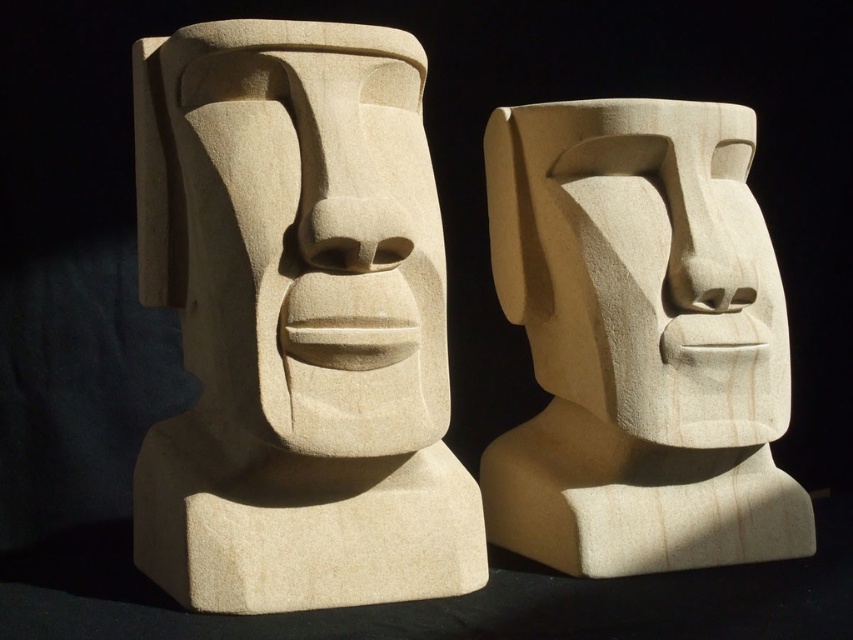
Does smooth beige stone moai head at center have a larger size compared to smooth beige stone head at center?

Correct, smooth beige stone moai head at center is larger in size than smooth beige stone head at center.

Does smooth beige stone moai head at center have a lesser height compared to smooth beige stone head at center?

No.

I want to click on smooth beige stone moai head at center, so click(297, 323).

The image size is (853, 640). In order to click on smooth beige stone moai head at center in this screenshot , I will do `click(297, 323)`.